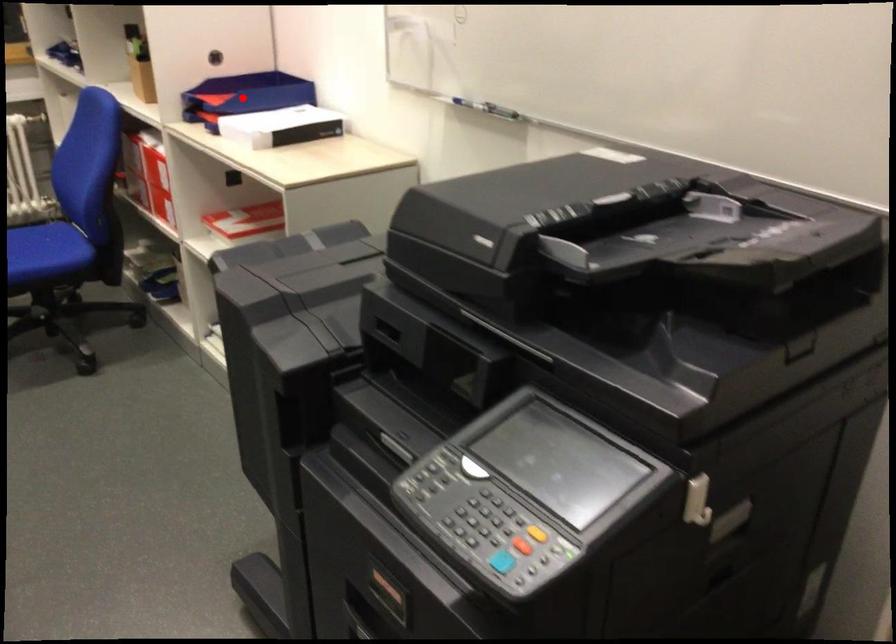
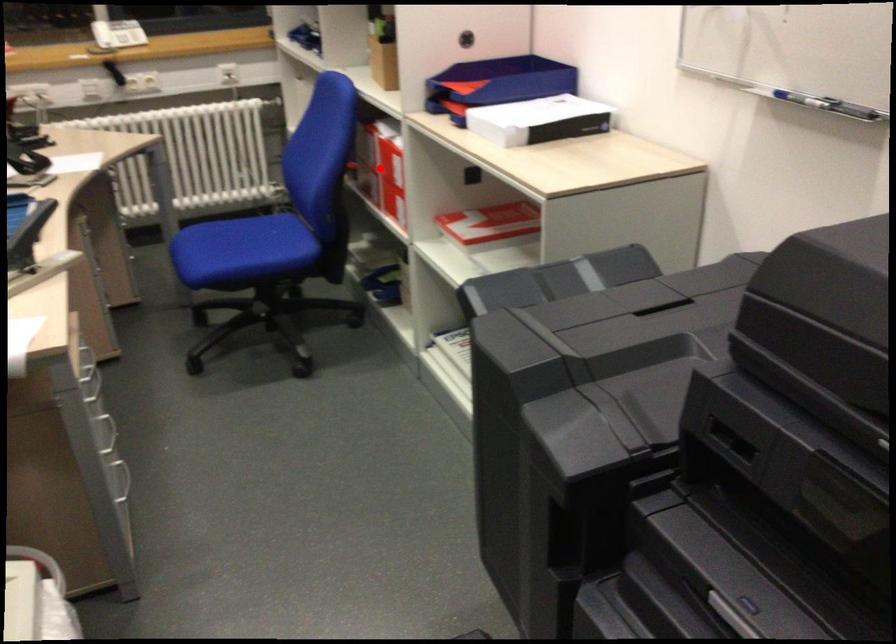
I am providing you with two images of the same scene from different viewpoints. A red point is marked on the first image and another point is marked on the second image. Is the marked point in image1 the same physical position as the marked point in image2?

No